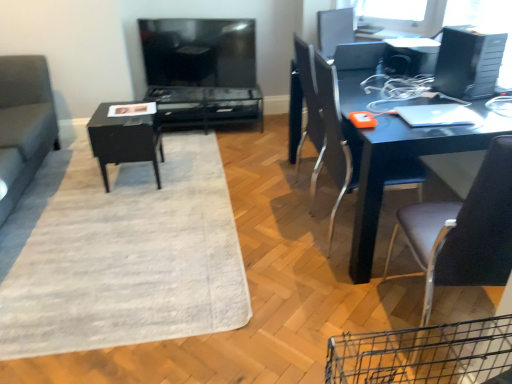
What do you see at coordinates (328, 128) in the screenshot? The width and height of the screenshot is (512, 384). I see `matte black chair at right, which is counted as the 2th chair, starting from the front` at bounding box center [328, 128].

At what (x,y) coordinates should I click in order to perform the action: click on black glossy table at center, the second table viewed from the front. Please return your answer as a coordinate pair (x, y). This screenshot has width=512, height=384. Looking at the image, I should click on pos(206,105).

In order to face black glossy table at center, the first table in the back-to-front sequence, should I rotate leftwards or rightwards?

Turn left approximately 6.636 degrees to face it.

What do you see at coordinates (468, 62) in the screenshot?
I see `black plastic desktop computer at upper right` at bounding box center [468, 62].

Looking at this image, what is the approximate height of leather-like brown chair at right, which is counted as the 2th chair, starting from the back?

3.30 feet.

What do you see at coordinates (437, 115) in the screenshot? This screenshot has width=512, height=384. I see `silver metallic laptop at upper right` at bounding box center [437, 115].

Where is `matte black chair at right, the 1th chair when ordered from back to front`? matte black chair at right, the 1th chair when ordered from back to front is located at coordinates (328, 128).

From a real-world perspective, between black plastic desktop computer at upper right and matte black tv at upper center, who is vertically higher?

black plastic desktop computer at upper right.

How many degrees apart are the facing directions of black plastic desktop computer at upper right and matte black tv at upper center?

The angular difference between black plastic desktop computer at upper right and matte black tv at upper center is 64.6 degrees.

Is black plastic desktop computer at upper right shorter than matte black tv at upper center?

Yes.

Does black plastic desktop computer at upper right turn towards matte black tv at upper center?

No, black plastic desktop computer at upper right does not turn towards matte black tv at upper center.

Is suede gray couch at left next to matte black chair at right, which is counted as the 2th chair, starting from the front?

suede gray couch at left and matte black chair at right, which is counted as the 2th chair, starting from the front, are not in contact.

Is suede gray couch at left to the left of matte black chair at right, the 1th chair when ordered from back to front, from the viewer's perspective?

Indeed, suede gray couch at left is positioned on the left side of matte black chair at right, the 1th chair when ordered from back to front.

Between point (28, 155) and point (298, 154), which one is positioned in front?

The point (28, 155) is in front.

Consider the image. Considering the relative sizes of matte black tv at upper center and leather-like brown chair at right, which appears as the 1th chair when viewed from the front, in the image provided, is matte black tv at upper center thinner than leather-like brown chair at right, which appears as the 1th chair when viewed from the front,?

Yes.

Is matte black tv at upper center looking in the opposite direction of leather-like brown chair at right, which appears as the 1th chair when viewed from the front?

No, matte black tv at upper center is not facing the opposite direction of leather-like brown chair at right, which appears as the 1th chair when viewed from the front.

Based on their positions, is matte black tv at upper center located to the left or right of leather-like brown chair at right, which is counted as the 2th chair, starting from the back?

Clearly, matte black tv at upper center is on the left of leather-like brown chair at right, which is counted as the 2th chair, starting from the back, in the image.

Based on the photo, is matte black tv at upper center beside leather-like brown chair at right, which appears as the 1th chair when viewed from the front?

matte black tv at upper center and leather-like brown chair at right, which appears as the 1th chair when viewed from the front, are clearly separated.

Considering the sizes of objects suede gray couch at left and black glossy table at center, the second table viewed from the front, in the image provided, who is bigger, suede gray couch at left or black glossy table at center, the second table viewed from the front,?

Bigger between the two is suede gray couch at left.

Is suede gray couch at left wider or thinner than black glossy table at center, the first table in the back-to-front sequence?

suede gray couch at left is wider than black glossy table at center, the first table in the back-to-front sequence.

How different are the orientations of matte black tv at upper center and black glossy table at center, which appears as the 2th table when viewed from the back, in degrees?

They differ by 13.8 degrees in their facing directions.

Where is `television on the right side of black glossy table at center, which appears as the 2th table when viewed from the back`? television on the right side of black glossy table at center, which appears as the 2th table when viewed from the back is located at coordinates (199, 52).

From the picture: Does matte black tv at upper center have a lesser width compared to black glossy table at center, which is the first table in front-to-back order?

Correct, the width of matte black tv at upper center is less than that of black glossy table at center, which is the first table in front-to-back order.

Looking at this image, is leather-like brown chair at right, which is counted as the 2th chair, starting from the back, situated inside silver metallic laptop at upper right or outside?

leather-like brown chair at right, which is counted as the 2th chair, starting from the back, exists outside the volume of silver metallic laptop at upper right.

How much distance is there between leather-like brown chair at right, which is counted as the 2th chair, starting from the back, and silver metallic laptop at upper right?

The distance of leather-like brown chair at right, which is counted as the 2th chair, starting from the back, from silver metallic laptop at upper right is 20.43 inches.

Which object is positioned more to the left, leather-like brown chair at right, which is counted as the 2th chair, starting from the back, or silver metallic laptop at upper right?

Positioned to the left is leather-like brown chair at right, which is counted as the 2th chair, starting from the back.

Which is behind, leather-like brown chair at right, which is counted as the 2th chair, starting from the back, or silver metallic laptop at upper right?

silver metallic laptop at upper right is further from the camera.

In the scene shown: Who is bigger, leather-like brown chair at right, which appears as the 1th chair when viewed from the front, or matte black chair at right, which is counted as the 2th chair, starting from the front?

With larger size is matte black chair at right, which is counted as the 2th chair, starting from the front.

From a real-world perspective, is leather-like brown chair at right, which appears as the 1th chair when viewed from the front, positioned over matte black chair at right, which is counted as the 2th chair, starting from the front, based on gravity?

No.

Is leather-like brown chair at right, which appears as the 1th chair when viewed from the front, located outside matte black chair at right, which is counted as the 2th chair, starting from the front?

Yes, leather-like brown chair at right, which appears as the 1th chair when viewed from the front, is located beyond the bounds of matte black chair at right, which is counted as the 2th chair, starting from the front.

From their relative heights in the image, would you say leather-like brown chair at right, which is counted as the 2th chair, starting from the back, is taller or shorter than matte black chair at right, which is counted as the 2th chair, starting from the front?

Clearly, leather-like brown chair at right, which is counted as the 2th chair, starting from the back, is taller compared to matte black chair at right, which is counted as the 2th chair, starting from the front.

The image size is (512, 384). Find the location of `desktop computer below the matte black tv at upper center (from the image's perspective)`. desktop computer below the matte black tv at upper center (from the image's perspective) is located at coordinates (468, 62).

Locate an element on the screen. The height and width of the screenshot is (384, 512). studio couch on the left of matte black chair at right, which is counted as the 2th chair, starting from the front is located at coordinates (24, 123).

Estimate the real-world distances between objects in this image. Which object is further from silver metallic laptop at upper right, leather-like brown chair at right, which appears as the 1th chair when viewed from the front, or matte black tv at upper center?

Among the two, matte black tv at upper center is located further to silver metallic laptop at upper right.

When comparing their distances from matte black tv at upper center, does matte black chair at right, the 1th chair when ordered from back to front, or suede gray couch at left seem further?

The object further to matte black tv at upper center is matte black chair at right, the 1th chair when ordered from back to front.

Looking at the image, which one is located further to black plastic desktop computer at upper right, metallic blue desk at right or black glossy table at center, which appears as the 2th table when viewed from the back?

black glossy table at center, which appears as the 2th table when viewed from the back, lies further to black plastic desktop computer at upper right than the other object.

Estimate the real-world distances between objects in this image. Which object is closer to silver metallic laptop at upper right, leather-like brown chair at right, which appears as the 1th chair when viewed from the front, or suede gray couch at left?

Based on the image, leather-like brown chair at right, which appears as the 1th chair when viewed from the front, appears to be nearer to silver metallic laptop at upper right.

When comparing their distances from leather-like brown chair at right, which is counted as the 2th chair, starting from the back, does black plastic desktop computer at upper right or silver metallic laptop at upper right seem further?

black plastic desktop computer at upper right is positioned further to the anchor leather-like brown chair at right, which is counted as the 2th chair, starting from the back.

Estimate the real-world distances between objects in this image. Which object is further from suede gray couch at left, black plastic desktop computer at upper right or black glossy table at center, the first table in the back-to-front sequence?

black plastic desktop computer at upper right is positioned further to the anchor suede gray couch at left.

From the image, which object appears to be nearer to black glossy table at center, which is the first table in front-to-back order, black glossy table at center, the first table in the back-to-front sequence, or suede gray couch at left?

Based on the image, suede gray couch at left appears to be nearer to black glossy table at center, which is the first table in front-to-back order.

Considering their positions, is leather-like brown chair at right, which is counted as the 2th chair, starting from the back, positioned closer to black glossy table at center, the first table in the back-to-front sequence, than matte black tv at upper center?

Among the two, matte black tv at upper center is located nearer to black glossy table at center, the first table in the back-to-front sequence.

This screenshot has width=512, height=384. I want to click on television located between silver metallic laptop at upper right and black glossy table at center, the second table viewed from the front, in the depth direction, so click(199, 52).

Locate an element on the screen. Image resolution: width=512 pixels, height=384 pixels. laptop between black plastic desktop computer at upper right and metallic blue desk at right in the vertical direction is located at coordinates (437, 115).

Where is `desk positioned between leather-like brown chair at right, which is counted as the 2th chair, starting from the back, and silver metallic laptop at upper right from near to far`? This screenshot has height=384, width=512. desk positioned between leather-like brown chair at right, which is counted as the 2th chair, starting from the back, and silver metallic laptop at upper right from near to far is located at coordinates (403, 158).

At what (x,y) coordinates should I click in order to perform the action: click on desk positioned between leather-like brown chair at right, which is counted as the 2th chair, starting from the back, and matte black tv at upper center from near to far. Please return your answer as a coordinate pair (x, y). The height and width of the screenshot is (384, 512). Looking at the image, I should click on (403, 158).